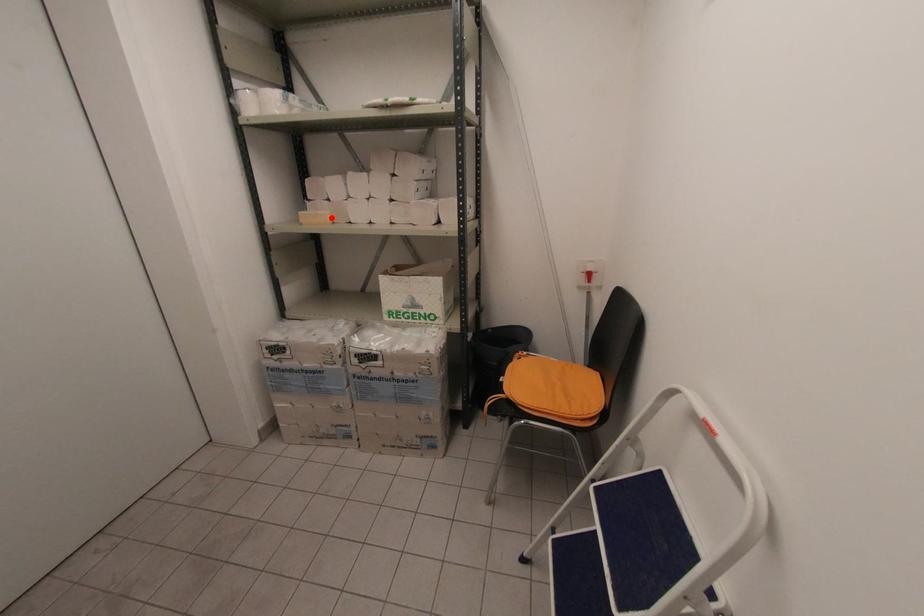
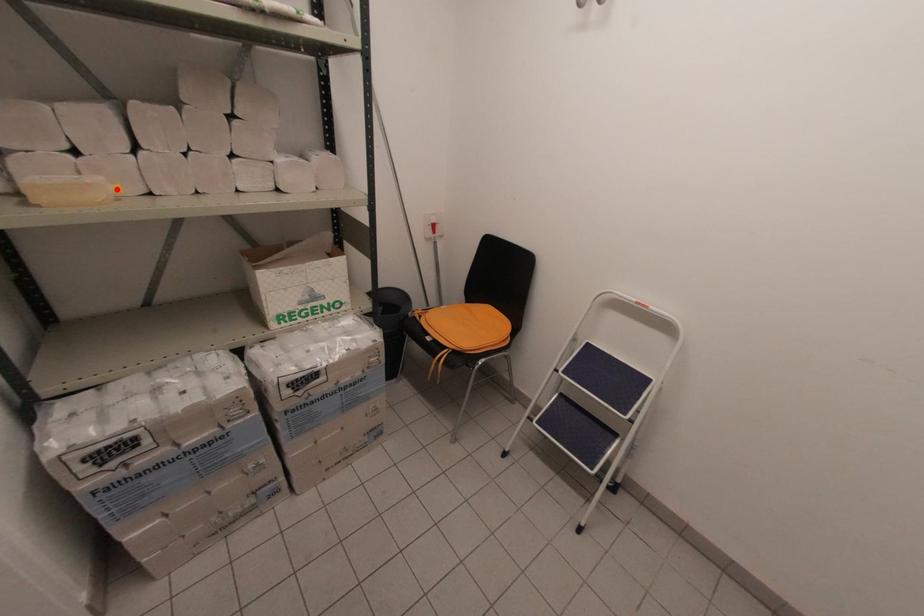
I am providing you with two images of the same scene from different viewpoints. A red point is marked on the first image and another point is marked on the second image. Does the point marked in image1 correspond to the same location as the one in image2?

Yes